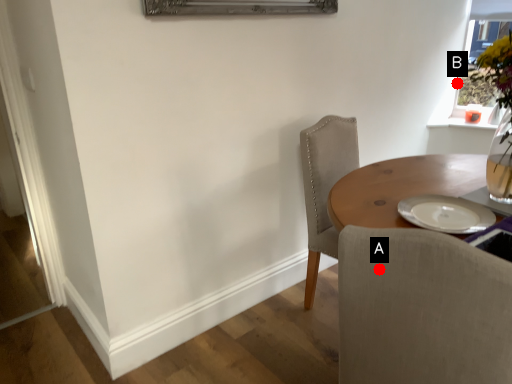
Question: Two points are circled on the image, labeled by A and B beside each circle. Which point is farther to the camera?

Choices:
 (A) A is further
 (B) B is further

Answer: (B)